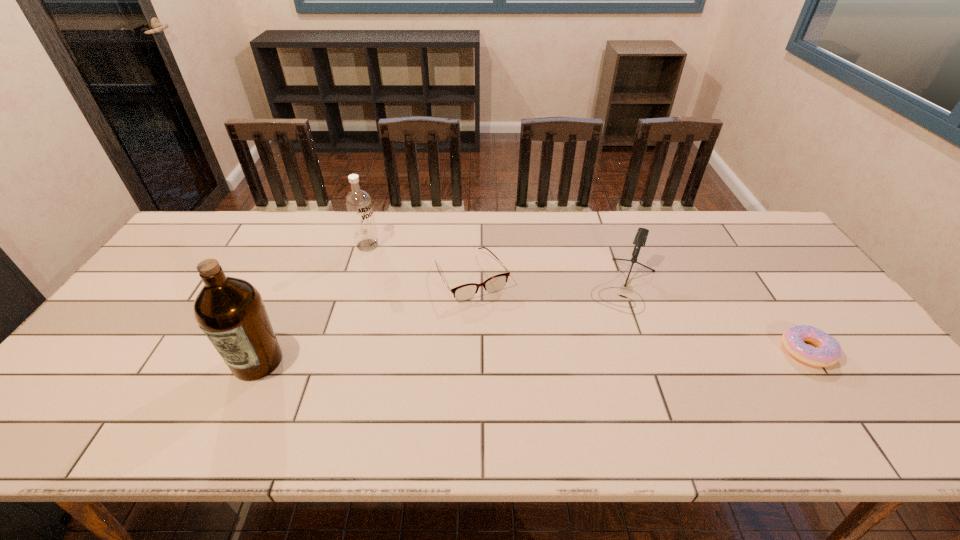
This screenshot has width=960, height=540. Find the location of `free space located on the front label of the second object from left to right`. free space located on the front label of the second object from left to right is located at coordinates (458, 309).

Image resolution: width=960 pixels, height=540 pixels. Find the location of `spectacles situated at the far edge`. spectacles situated at the far edge is located at coordinates (465, 292).

At what (x,y) coordinates should I click in order to perform the action: click on vodka at the far edge. Please return your answer as a coordinate pair (x, y). This screenshot has width=960, height=540. Looking at the image, I should click on (358, 202).

The width and height of the screenshot is (960, 540). In order to click on object that is at the near edge in this screenshot , I will do `click(230, 311)`.

The width and height of the screenshot is (960, 540). I want to click on object positioned at the right edge, so click(827, 352).

At what (x,y) coordinates should I click in order to perform the action: click on blank space at the far edge of the desktop. Please return your answer as a coordinate pair (x, y). This screenshot has height=540, width=960. Looking at the image, I should click on (571, 253).

What are the coordinates of `vacant space at the near edge of the desktop` in the screenshot? It's located at (775, 396).

Find the location of `vacant space at the left edge of the desktop`. vacant space at the left edge of the desktop is located at coordinates (129, 319).

Identify the location of free location at the right edge. The image size is (960, 540). (804, 288).

This screenshot has width=960, height=540. I want to click on vacant space at the far left corner of the desktop, so coord(212,227).